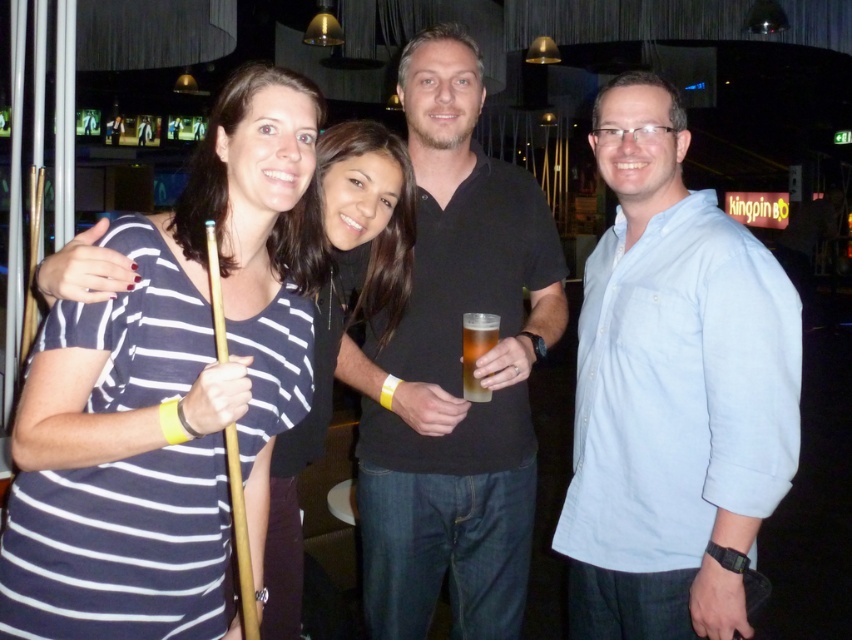
Question: Which point is closer to the camera?

Choices:
 (A) light blue button-down shirt at right
 (B) striped fabric shirt at center

Answer: (A)

Question: Is light blue button-down shirt at right to the right of translucent plastic cup at center from the viewer's perspective?

Choices:
 (A) yes
 (B) no

Answer: (A)

Question: Is light blue button-down shirt at right to the left of translucent plastic cup at center from the viewer's perspective?

Choices:
 (A) yes
 (B) no

Answer: (B)

Question: Is striped fabric shirt at center to the right of translucent plastic cup at center from the viewer's perspective?

Choices:
 (A) no
 (B) yes

Answer: (A)

Question: Estimate the real-world distances between objects in this image. Which object is farther from the translucent plastic cup at center?

Choices:
 (A) striped fabric shirt at center
 (B) light blue button-down shirt at right
 (C) black cotton shirt at center

Answer: (B)

Question: Which object appears farthest from the camera in this image?

Choices:
 (A) striped fabric shirt at center
 (B) black cotton shirt at center

Answer: (B)